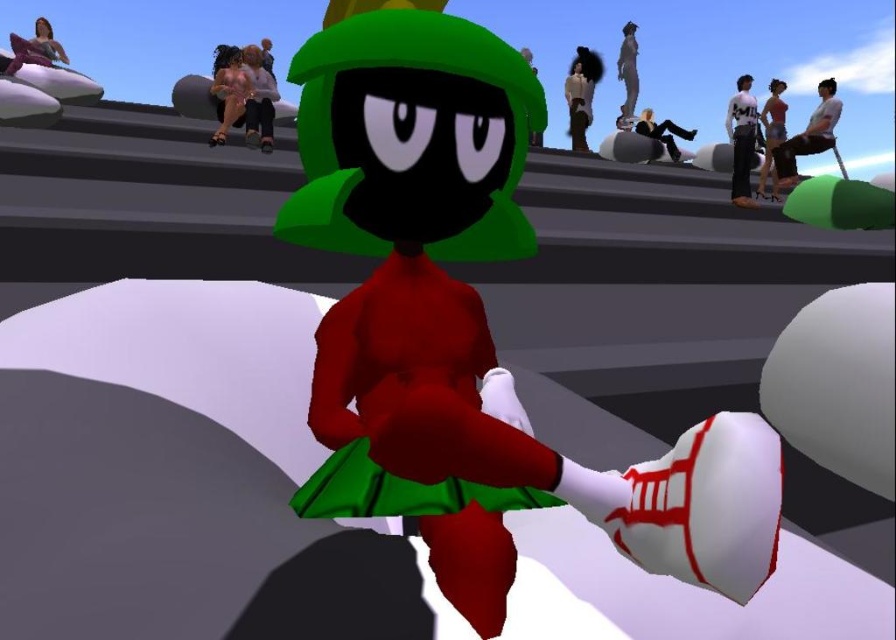
Question: Among these objects, which one is farthest from the camera?

Choices:
 (A) smooth gray statue at upper right
 (B) white matte jacket at upper center

Answer: (B)

Question: Which point is farther from the camera taking this photo?

Choices:
 (A) (653, 131)
 (B) (457, 541)

Answer: (A)

Question: Where is smooth skin woman at center located in relation to white matte jacket at upper center in the image?

Choices:
 (A) above
 (B) below

Answer: (B)

Question: Does white cotton shirt at upper right appear on the left side of smooth black hair at upper right?

Choices:
 (A) no
 (B) yes

Answer: (B)

Question: Does rubberized red dress at center have a smaller size compared to matte pink fabric at upper left?

Choices:
 (A) yes
 (B) no

Answer: (A)

Question: Among these points, which one is nearest to the camera?

Choices:
 (A) (309, 74)
 (B) (784, 138)

Answer: (A)